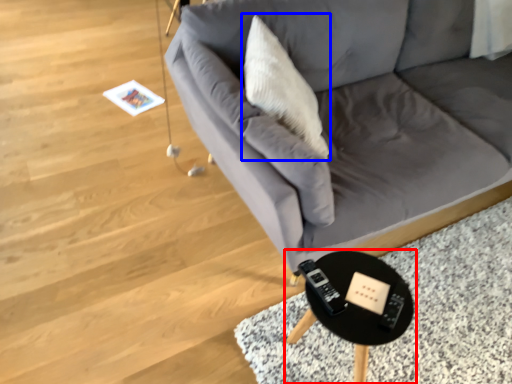
Question: Which of the following is the closest to the observer, table (highlighted by a red box) or throw pillow (highlighted by a blue box)?

Choices:
 (A) table
 (B) throw pillow

Answer: (A)